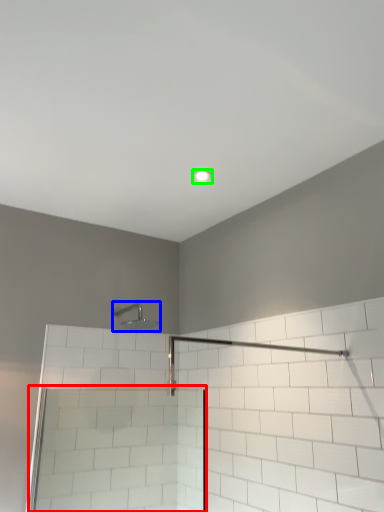
Question: Estimate the real-world distances between objects in this image. Which object is farther from screen door (highlighted by a red box), shower (highlighted by a blue box) or light fixture (highlighted by a green box)?

Choices:
 (A) shower
 (B) light fixture

Answer: (B)